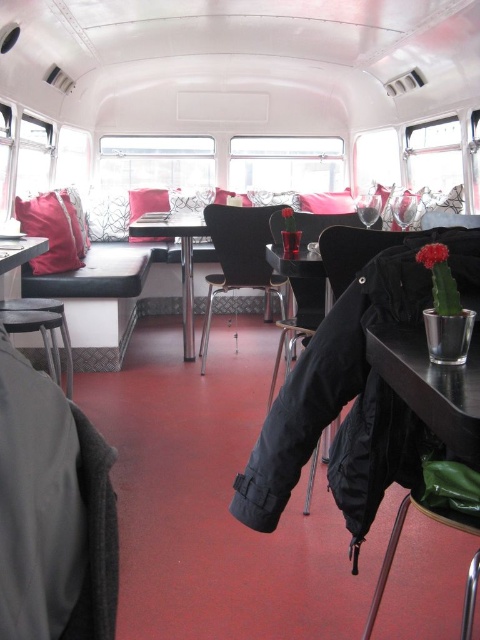
Question: Can you confirm if metallic stool at lower left is positioned to the left of velvet red pillow at left?

Choices:
 (A) no
 (B) yes

Answer: (A)

Question: Which is nearer to the metallic stool at lower left?

Choices:
 (A) clear glass window at center
 (B) metallic silver table at lower right
 (C) dark gray fabric jacket at lower left

Answer: (B)

Question: Estimate the real-world distances between objects in this image. Which object is farther from the black leather chair at center?

Choices:
 (A) metallic silver table at lower right
 (B) metallic silver table at center
 (C) metallic silver chair at center
 (D) metallic stool at lower left

Answer: (A)

Question: Is metallic silver table at lower right above metallic silver table at center?

Choices:
 (A) no
 (B) yes

Answer: (A)

Question: From the image, what is the correct spatial relationship of metallic silver table at lower right in relation to black leather chair at center?

Choices:
 (A) below
 (B) above

Answer: (A)

Question: Which is farther from the metallic silver table at lower right?

Choices:
 (A) clear glass window at center
 (B) black leather chair at center

Answer: (A)